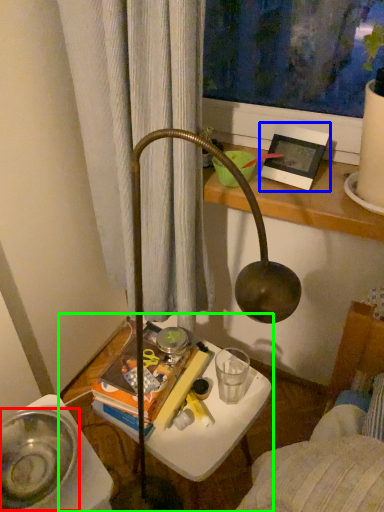
Question: Which is nearer to the glass bowl (highlighted by a red box)? picture frame (highlighted by a blue box) or table (highlighted by a green box).

Choices:
 (A) picture frame
 (B) table

Answer: (B)